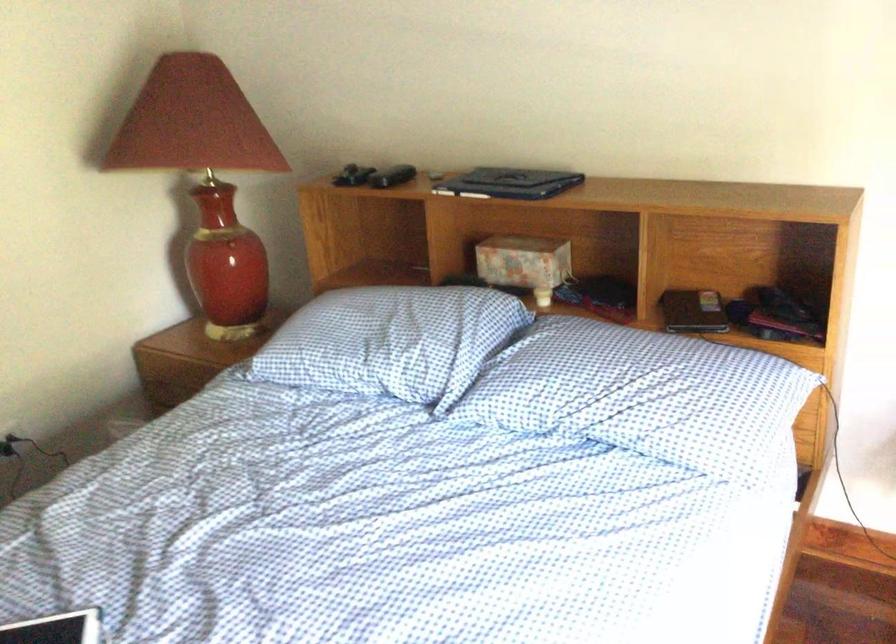
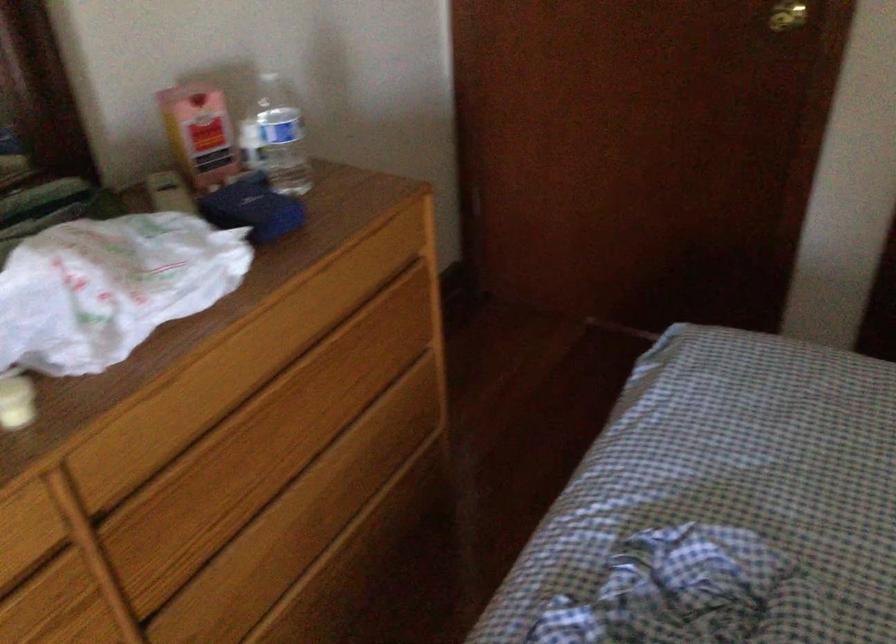
The images are taken continuously from a first-person perspective. In which direction is your viewpoint rotating?

The camera's rotation is toward left-down.